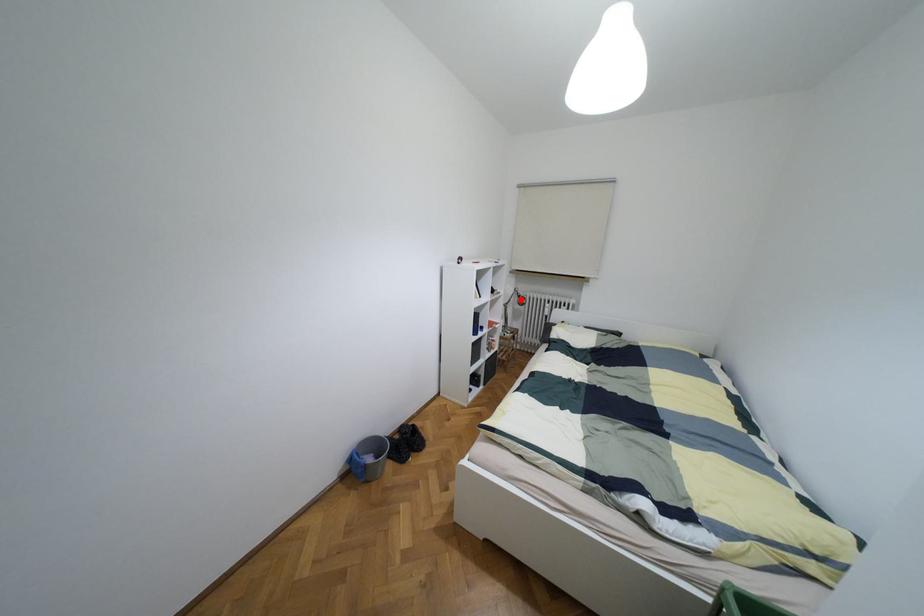
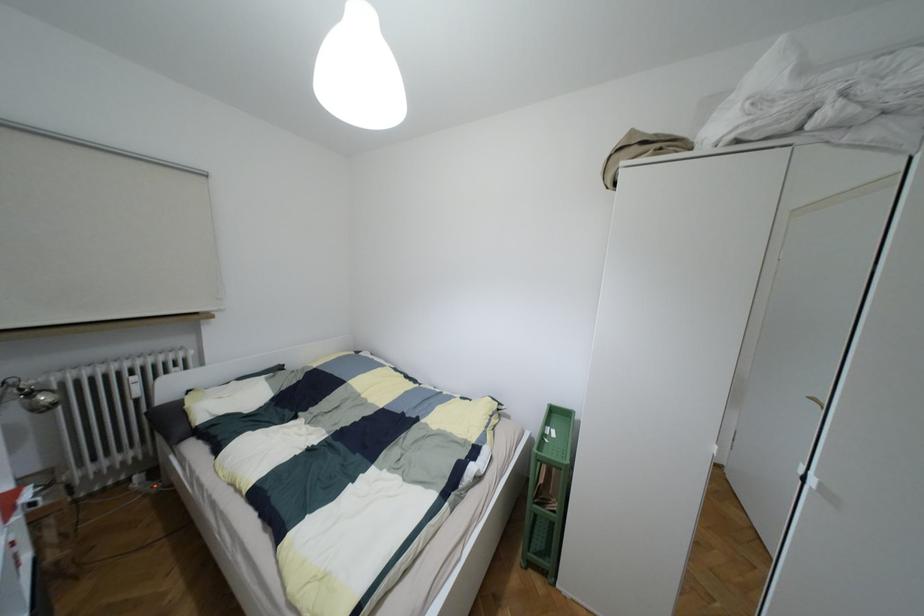
Question: I am providing you with two images of the same scene from different viewpoints. Given a red point in image1, look at the same physical point in image2. Is it:

Choices:
 (A) Closer to the viewpoint
 (B) Farther from the viewpoint

Answer: (B)